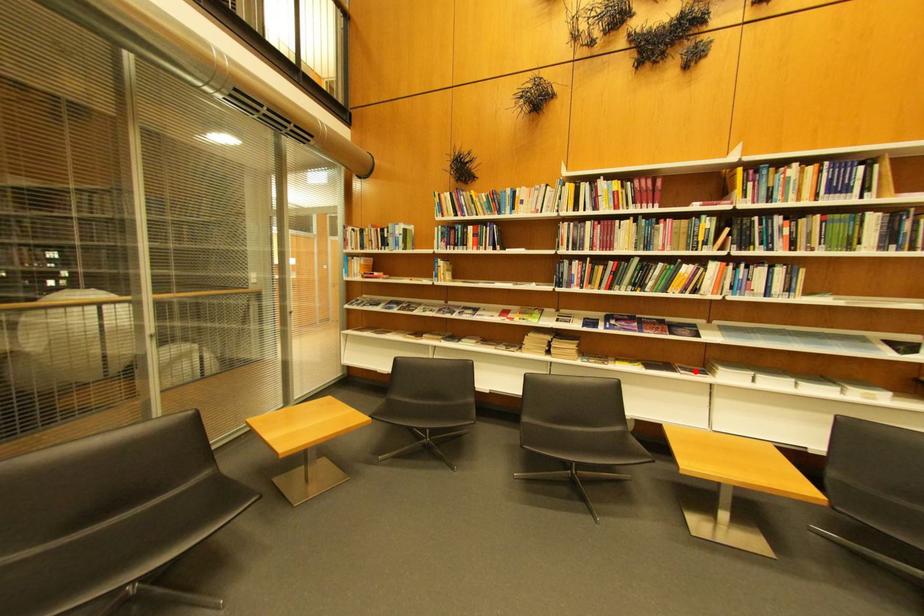
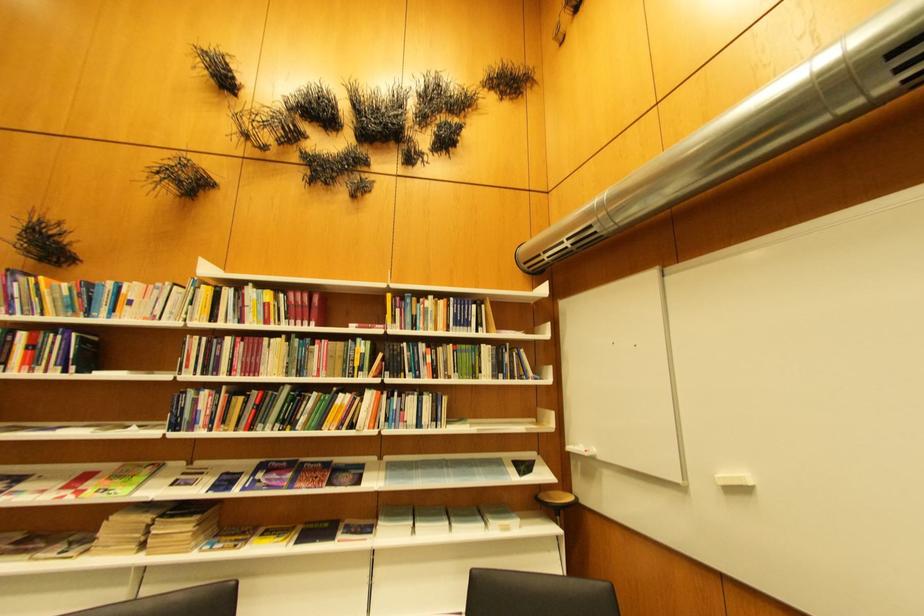
Find the pixel in the second image that matches the highlighted location in the first image.

(359, 531)